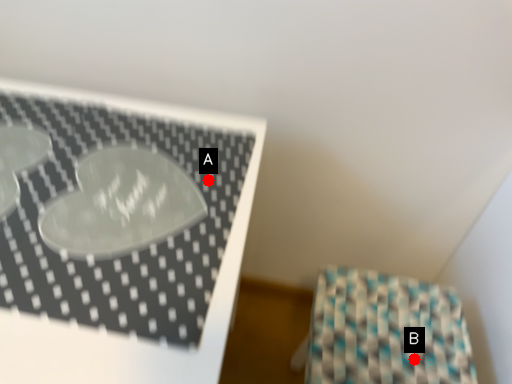
Question: Two points are circled on the image, labeled by A and B beside each circle. Among these points, which one is farthest from the camera?

Choices:
 (A) A is further
 (B) B is further

Answer: (B)